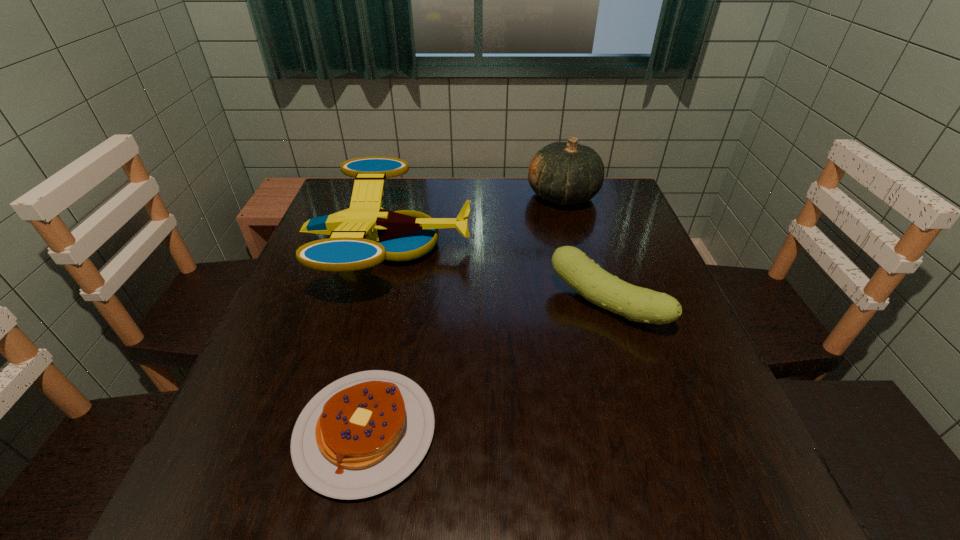
In the image, there is a desktop. Identify the location of vacant space at the near edge. (647, 466).

Identify the location of free region at the left edge of the desktop. This screenshot has width=960, height=540. (349, 313).

The width and height of the screenshot is (960, 540). Find the location of `free space at the right edge of the desktop`. free space at the right edge of the desktop is located at coordinates coord(680,377).

This screenshot has height=540, width=960. What are the coordinates of `vacant space at the far right corner of the desktop` in the screenshot? It's located at (620, 216).

This screenshot has height=540, width=960. In order to click on vacant space at the near right corner of the desktop in this screenshot , I will do `click(735, 481)`.

Where is `empty space that is in between the third shortest object and the cucumber`? The height and width of the screenshot is (540, 960). empty space that is in between the third shortest object and the cucumber is located at coordinates (498, 276).

The height and width of the screenshot is (540, 960). I want to click on free area in between the shortest object and the drone, so tap(377, 339).

Identify the location of free space between the gourd and the shortest object. (465, 314).

The width and height of the screenshot is (960, 540). I want to click on free spot between the tallest object and the second tallest object, so click(x=476, y=221).

At what (x,y) coordinates should I click in order to perform the action: click on vacant region between the drone and the shortest object. Please return your answer as a coordinate pair (x, y). Image resolution: width=960 pixels, height=540 pixels. Looking at the image, I should click on (377, 339).